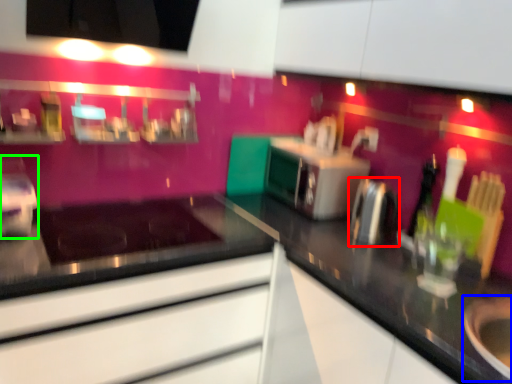
Question: Considering the real-world distances, which object is closest to appliance (highlighted by a red box)? appliance (highlighted by a blue box) or appliance (highlighted by a green box).

Choices:
 (A) appliance
 (B) appliance

Answer: (A)